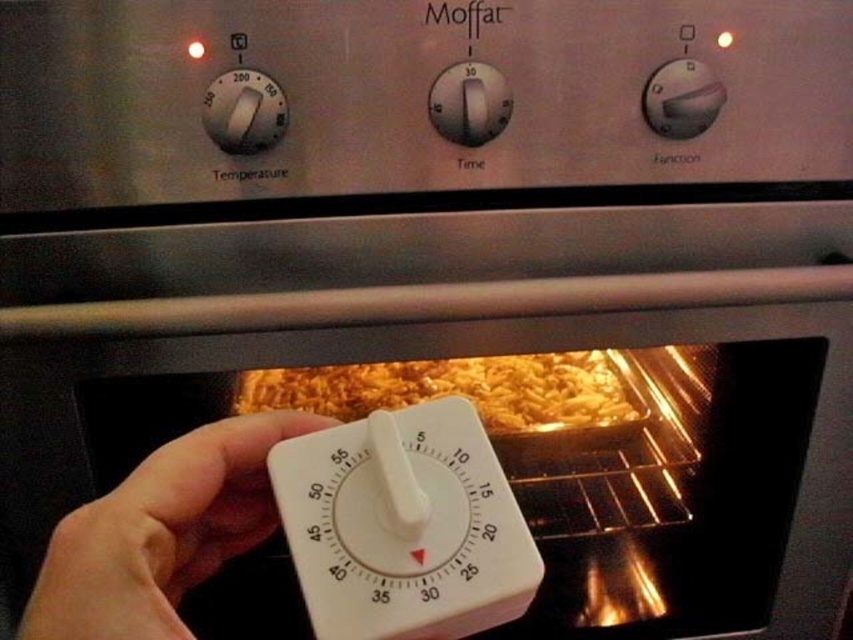
This screenshot has height=640, width=853. What do you see at coordinates (404, 525) in the screenshot? I see `white plastic timer at center` at bounding box center [404, 525].

Is white plastic timer at center thinner than white plastic thermostat at upper left?

No, white plastic timer at center is not thinner than white plastic thermostat at upper left.

Find the location of a particular element. white plastic timer at center is located at coordinates (404, 525).

In order to click on white plastic timer at center in this screenshot , I will do `click(404, 525)`.

Does white plastic timer at lower center appear on the left side of white plastic thermostat at upper left?

Incorrect, white plastic timer at lower center is not on the left side of white plastic thermostat at upper left.

Between white plastic timer at lower center and white plastic thermostat at upper left, which one appears on the right side from the viewer's perspective?

Positioned to the right is white plastic timer at lower center.

Is point (184, 588) farther from camera compared to point (221, 138)?

No, it is in front of (221, 138).

The height and width of the screenshot is (640, 853). I want to click on white plastic timer at lower center, so click(x=160, y=532).

Describe the element at coordinates (160, 532) in the screenshot. This screenshot has width=853, height=640. I see `white plastic timer at lower center` at that location.

Can you confirm if white plastic timer at lower center is thinner than golden brown pasta at center?

Yes.

Where is `white plastic timer at lower center`? The width and height of the screenshot is (853, 640). white plastic timer at lower center is located at coordinates (160, 532).